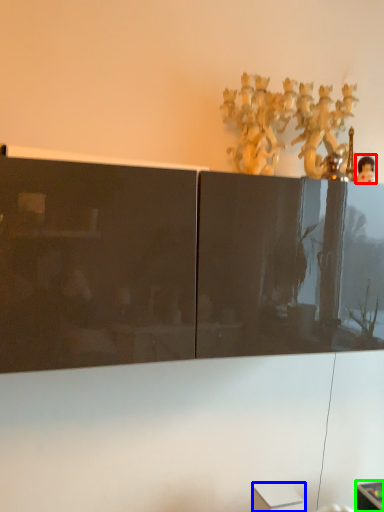
Question: Which is farther away from toy (highlighted by a red box)? cabinetry (highlighted by a blue box) or furniture (highlighted by a green box)?

Choices:
 (A) cabinetry
 (B) furniture

Answer: (B)